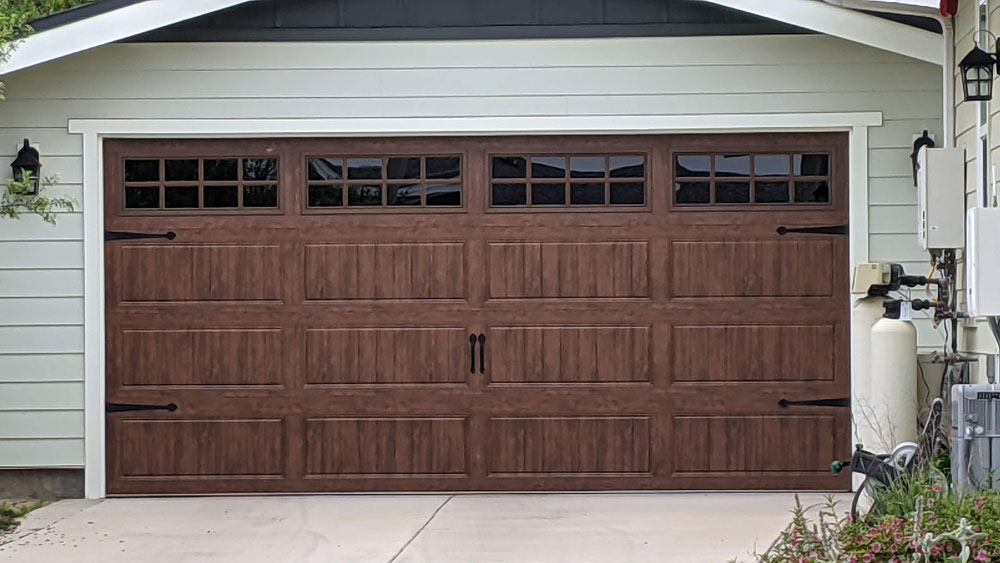
Identify the location of handles. The height and width of the screenshot is (563, 1000). (472, 351), (480, 348).